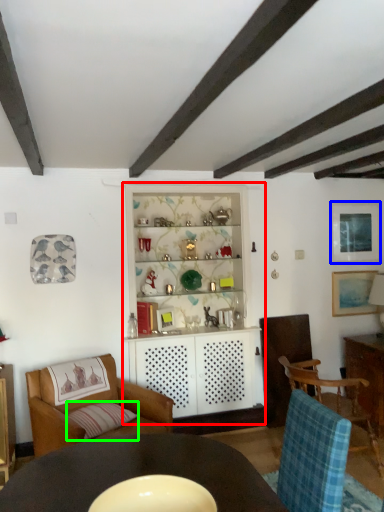
Question: Which object is the closest to the dresser (highlighted by a red box)? Choose among these: picture frame (highlighted by a blue box) or pillow (highlighted by a green box).

Choices:
 (A) picture frame
 (B) pillow

Answer: (B)